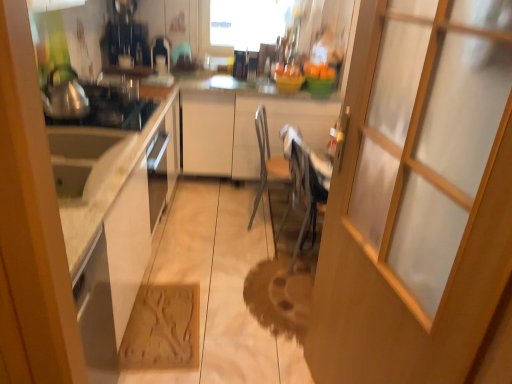
Find the location of a particular element. The height and width of the screenshot is (384, 512). transparent glass window at upper center is located at coordinates (247, 22).

This screenshot has height=384, width=512. Find the location of `shiny metallic gas stove at left`. shiny metallic gas stove at left is located at coordinates (110, 110).

This screenshot has height=384, width=512. What are the coordinates of `metallic gray chair at center, arranged as the 2th chair when viewed from the back` in the screenshot? It's located at (305, 179).

The image size is (512, 384). In order to click on transparent glass door at center in this screenshot , I will do `click(418, 196)`.

What is the approximate height of transparent glass door at center?

5.21 feet.

What are the coordinates of `brushed metal tea pot at left` in the screenshot? It's located at pos(65,96).

Where is `transparent glass window at upper center`? Image resolution: width=512 pixels, height=384 pixels. transparent glass window at upper center is located at coordinates (247, 22).

Is brown textured mat at lower center at the back of brushed metal tea pot at left?

brushed metal tea pot at left does not have its back to brown textured mat at lower center.

There is a brown textured mat at lower center. What are the coordinates of `tea pot above it (from a real-world perspective)` in the screenshot? It's located at (65, 96).

Looking at this image, considering the relative sizes of brushed metal tea pot at left and brown textured mat at lower center in the image provided, is brushed metal tea pot at left thinner than brown textured mat at lower center?

Yes, brushed metal tea pot at left is thinner than brown textured mat at lower center.

Which is correct: brushed metal tea pot at left is inside brown textured mat at lower center, or outside of it?

brushed metal tea pot at left is outside brown textured mat at lower center.

How far apart are metallic gray chair at center, arranged as the 2th chair when viewed from the back, and shiny metallic gas stove at left?

metallic gray chair at center, arranged as the 2th chair when viewed from the back, is 37.69 inches away from shiny metallic gas stove at left.

Looking at this image, is metallic gray chair at center, the first chair positioned from the front, next to shiny metallic gas stove at left and touching it?

No, metallic gray chair at center, the first chair positioned from the front, is not next to shiny metallic gas stove at left.

From a real-world perspective, is metallic gray chair at center, arranged as the 2th chair when viewed from the back, located beneath shiny metallic gas stove at left?

Indeed, from a real-world perspective, metallic gray chair at center, arranged as the 2th chair when viewed from the back, is positioned beneath shiny metallic gas stove at left.

Considering the sizes of objects metallic gray chair at center, arranged as the 2th chair when viewed from the back, and shiny metallic gas stove at left in the image provided, who is wider, metallic gray chair at center, arranged as the 2th chair when viewed from the back, or shiny metallic gas stove at left?

With larger width is shiny metallic gas stove at left.

At what (x,y) coordinates should I click in order to perform the action: click on tea pot above the shiny metallic gas stove at left (from the image's perspective). Please return your answer as a coordinate pair (x, y). Looking at the image, I should click on (65, 96).

Are brushed metal tea pot at left and shiny metallic gas stove at left located far from each other?

No, brushed metal tea pot at left is in close proximity to shiny metallic gas stove at left.

Choose the correct answer: Is brushed metal tea pot at left inside shiny metallic gas stove at left or outside it?

brushed metal tea pot at left exists outside the volume of shiny metallic gas stove at left.

From the image's perspective, is brushed metal tea pot at left beneath shiny metallic gas stove at left?

No, from the image's perspective, brushed metal tea pot at left is not beneath shiny metallic gas stove at left.

Who is bigger, transparent glass window at upper center or shiny metallic gas stove at left?

Bigger between the two is transparent glass window at upper center.

From a real-world perspective, does transparent glass window at upper center sit lower than shiny metallic gas stove at left?

No, from a real-world perspective, transparent glass window at upper center is not under shiny metallic gas stove at left.

Can you tell me how much transparent glass window at upper center and shiny metallic gas stove at left differ in facing direction?

There is a 88.2-degree angle between the facing directions of transparent glass window at upper center and shiny metallic gas stove at left.

From the image's perspective, which object appears higher, transparent glass window at upper center or shiny metallic gas stove at left?

transparent glass window at upper center appears higher in the image.

From a real-world perspective, is transparent glass door at center located beneath shiny metallic gas stove at left?

Yes, from a real-world perspective, transparent glass door at center is beneath shiny metallic gas stove at left.

Which object is positioned more to the left, transparent glass door at center or shiny metallic gas stove at left?

Positioned to the left is shiny metallic gas stove at left.

Does point (386, 57) come in front of point (124, 113)?

Yes, point (386, 57) is closer to viewer.

From the image's perspective, which object appears higher, transparent glass door at center or shiny metallic gas stove at left?

shiny metallic gas stove at left appears higher in the image.

Choose the correct answer: Is metallic silver chair at center, acting as the second chair starting from the front, inside shiny metallic gas stove at left or outside it?

metallic silver chair at center, acting as the second chair starting from the front, exists outside the volume of shiny metallic gas stove at left.

Is metallic silver chair at center, acting as the second chair starting from the front, turned away from shiny metallic gas stove at left?

metallic silver chair at center, acting as the second chair starting from the front, is not turned away from shiny metallic gas stove at left.

Considering the points (251, 218) and (111, 116), which point is in front, point (251, 218) or point (111, 116)?

Positioned in front is point (111, 116).

From the image's perspective, would you say brown textured mat at lower center is positioned over transparent glass door at center?

No, from the image's perspective, brown textured mat at lower center is not above transparent glass door at center.

Considering the relative positions of brown textured mat at lower center and transparent glass door at center in the image provided, is brown textured mat at lower center to the left of transparent glass door at center from the viewer's perspective?

Correct, you'll find brown textured mat at lower center to the left of transparent glass door at center.

Does brown textured mat at lower center have a smaller size compared to transparent glass door at center?

Yes.

Could you tell me if brown textured mat at lower center is turned towards transparent glass door at center?

No, brown textured mat at lower center is not turned towards transparent glass door at center.

You are a GUI agent. You are given a task and a screenshot of the screen. Output one action in this format:
    pyautogui.click(x=<x>, y=<y>)
    Task: Click on the cardboard below the brushed metal tea pot at left (from a real-world perspective)
    
    Given the screenshot: What is the action you would take?
    pyautogui.click(x=162, y=328)

At what (x,y) coordinates should I click in order to perform the action: click on chair that is the 2nd one when counting downward from the shiny metallic gas stove at left (from the image's perspective). Please return your answer as a coordinate pair (x, y). Looking at the image, I should click on 305,179.

Which object lies nearer to the anchor point brown textured mat at lower center, white matte cabinet at center or metallic silver chair at center, the 1th chair in the back-to-front sequence?

Based on the image, metallic silver chair at center, the 1th chair in the back-to-front sequence, appears to be nearer to brown textured mat at lower center.

When comparing their distances from metallic silver chair at center, the 1th chair in the back-to-front sequence, does metallic gray chair at center, arranged as the 2th chair when viewed from the back, or brushed metal tea pot at left seem further?

Among the two, brushed metal tea pot at left is located further to metallic silver chair at center, the 1th chair in the back-to-front sequence.

Considering their positions, is metallic silver chair at center, the 1th chair in the back-to-front sequence, positioned further to transparent glass window at upper center than transparent glass door at center?

Based on the image, transparent glass door at center appears to be further to transparent glass window at upper center.

Considering their positions, is transparent glass door at center positioned closer to brown textured mat at lower center than metallic gray chair at center, the first chair positioned from the front?

metallic gray chair at center, the first chair positioned from the front, is closer to brown textured mat at lower center.

When comparing their distances from shiny metallic gas stove at left, does brushed metal tea pot at left or metallic silver chair at center, the 1th chair in the back-to-front sequence, seem closer?

brushed metal tea pot at left is positioned closer to the anchor shiny metallic gas stove at left.

In the scene shown: From the image, which object appears to be farther from brushed metal tea pot at left, transparent glass door at center or metallic silver chair at center, the 1th chair in the back-to-front sequence?

transparent glass door at center is positioned further to the anchor brushed metal tea pot at left.

From the image, which object appears to be farther from brushed metal tea pot at left, transparent glass door at center or transparent glass window at upper center?

transparent glass window at upper center is positioned further to the anchor brushed metal tea pot at left.

Estimate the real-world distances between objects in this image. Which object is further from shiny metallic gas stove at left, transparent glass window at upper center or white matte cabinet at center?

transparent glass window at upper center is further to shiny metallic gas stove at left.

This screenshot has width=512, height=384. Find the location of `gas stove between white matte cabinet at center and brown textured mat at lower center in the vertical direction`. gas stove between white matte cabinet at center and brown textured mat at lower center in the vertical direction is located at coordinates (110, 110).

The width and height of the screenshot is (512, 384). In order to click on cabinetry positioned between brushed metal tea pot at left and transparent glass window at upper center from near to far in this screenshot , I will do `click(243, 125)`.

Locate an element on the screen. Image resolution: width=512 pixels, height=384 pixels. cabinetry between brushed metal tea pot at left and metallic silver chair at center, the 1th chair in the back-to-front sequence is located at coordinates (243, 125).

In order to click on cabinetry between shiny metallic gas stove at left and transparent glass window at upper center from front to back in this screenshot , I will do `click(243, 125)`.